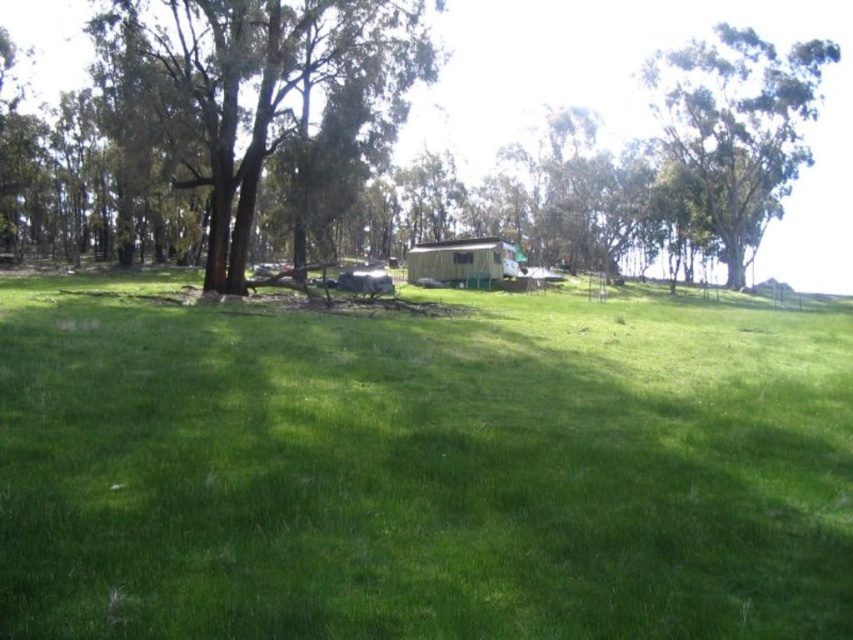
Question: Which point appears farthest from the camera in this image?

Choices:
 (A) (682, 68)
 (B) (769, 13)
 (C) (505, 257)

Answer: (B)

Question: Is green grassy field at center bigger than brown rough tree at center?

Choices:
 (A) yes
 (B) no

Answer: (B)

Question: Which object is the closest to the brown rough tree at center?

Choices:
 (A) green grassy field at center
 (B) white plastic hut at center
 (C) green leafy tree at upper right
 (D) brown textured tree at center

Answer: (A)

Question: Is brown textured tree at center positioned before green leafy tree at upper right?

Choices:
 (A) no
 (B) yes

Answer: (B)

Question: Observing the image, what is the correct spatial positioning of green leafy tree at upper right in reference to white plastic hut at center?

Choices:
 (A) above
 (B) below

Answer: (A)

Question: Which point appears closest to the camera in this image?

Choices:
 (A) (210, 81)
 (B) (461, 346)

Answer: (B)